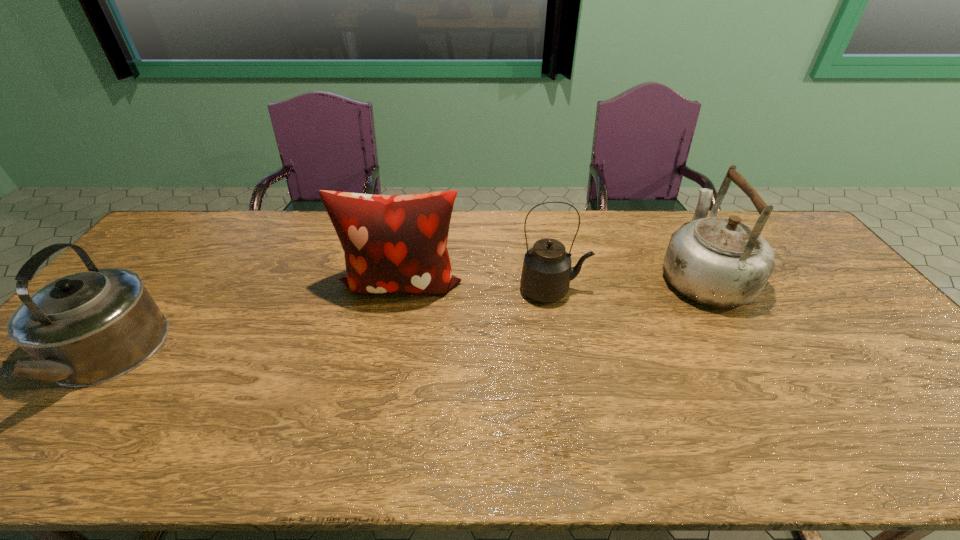
Where is `the rightmost kettle`? The image size is (960, 540). the rightmost kettle is located at coordinates (720, 262).

At what (x,y) coordinates should I click in order to perform the action: click on cushion. Please return your answer as a coordinate pair (x, y). Image resolution: width=960 pixels, height=540 pixels. Looking at the image, I should click on (393, 243).

Locate an element on the screen. The image size is (960, 540). the second object from right to left is located at coordinates (546, 274).

Identify the location of vacant space located 0.050m at the spout of the rightmost object. This screenshot has height=540, width=960. (679, 233).

Where is `blank space located at the spout of the rightmost object`? Image resolution: width=960 pixels, height=540 pixels. blank space located at the spout of the rightmost object is located at coordinates (679, 233).

The image size is (960, 540). In order to click on vacant space located at the spout of the rightmost object in this screenshot , I will do `click(672, 222)`.

The width and height of the screenshot is (960, 540). What are the coordinates of `free location located on the front-facing side of the cushion` in the screenshot? It's located at (377, 397).

In order to click on vacant space located spout on the second kettle from right to left in this screenshot , I will do `click(696, 291)`.

I want to click on object that is at the far edge, so click(x=720, y=262).

I want to click on vacant space at the far edge of the desktop, so click(263, 227).